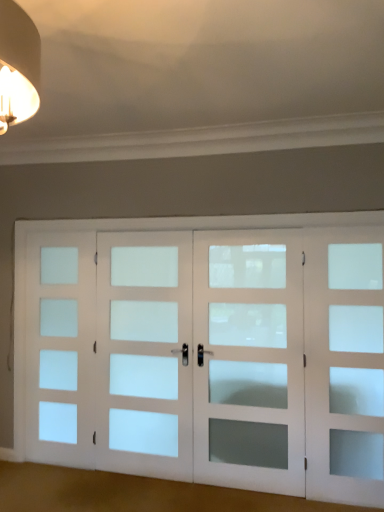
Question: Is white frosted glass door at left, which appears as the 1th screen door when viewed from the left, completely or partially inside white frosted glass door at center, acting as the second screen door starting from the right?

Choices:
 (A) yes
 (B) no

Answer: (B)

Question: From a real-world perspective, is white frosted glass door at center, acting as the second screen door starting from the right, positioned over white frosted glass door at left, which appears as the 1th screen door when viewed from the left, based on gravity?

Choices:
 (A) no
 (B) yes

Answer: (B)

Question: Considering the relative sizes of white frosted glass door at center, the third screen door in the left-to-right sequence, and white frosted glass door at left, which is the fourth screen door from right to left, in the image provided, is white frosted glass door at center, the third screen door in the left-to-right sequence, wider than white frosted glass door at left, which is the fourth screen door from right to left,?

Choices:
 (A) no
 (B) yes

Answer: (B)

Question: From the image's perspective, is white frosted glass door at center, the third screen door in the left-to-right sequence, beneath white frosted glass door at left, which is the fourth screen door from right to left?

Choices:
 (A) no
 (B) yes

Answer: (A)

Question: Considering the relative sizes of white frosted glass door at center, the third screen door in the left-to-right sequence, and white frosted glass door at left, which is the fourth screen door from right to left, in the image provided, is white frosted glass door at center, the third screen door in the left-to-right sequence, smaller than white frosted glass door at left, which is the fourth screen door from right to left,?

Choices:
 (A) yes
 (B) no

Answer: (B)

Question: Is white frosted glass door at center, acting as the second screen door starting from the right, oriented away from white frosted glass door at left, which appears as the 1th screen door when viewed from the left?

Choices:
 (A) yes
 (B) no

Answer: (B)

Question: Does white frosted glass door at center, the third screen door in the left-to-right sequence, have a greater height compared to white frosted glass door at right, which is counted as the fourth screen door, starting from the left?

Choices:
 (A) yes
 (B) no

Answer: (B)

Question: Is white frosted glass door at center, acting as the second screen door starting from the right, far away from white frosted glass door at right, which is the first screen door in right-to-left order?

Choices:
 (A) no
 (B) yes

Answer: (A)

Question: From a real-world perspective, is white frosted glass door at center, acting as the second screen door starting from the right, physically above white frosted glass door at right, which is counted as the fourth screen door, starting from the left?

Choices:
 (A) no
 (B) yes

Answer: (B)

Question: Is white frosted glass door at center, the third screen door in the left-to-right sequence, facing away from white frosted glass door at right, which is the first screen door in right-to-left order?

Choices:
 (A) yes
 (B) no

Answer: (B)

Question: Is white frosted glass door at center, the third screen door in the left-to-right sequence, to the left of white frosted glass door at right, which is counted as the fourth screen door, starting from the left, from the viewer's perspective?

Choices:
 (A) no
 (B) yes

Answer: (B)

Question: Would you say white frosted glass door at center, the third screen door in the left-to-right sequence, is outside white frosted glass door at right, which is counted as the fourth screen door, starting from the left?

Choices:
 (A) no
 (B) yes

Answer: (B)

Question: Is white frosted glass door at right, which is the first screen door in right-to-left order, looking in the opposite direction of white frosted glass door at center, the third screen door in the left-to-right sequence?

Choices:
 (A) yes
 (B) no

Answer: (B)